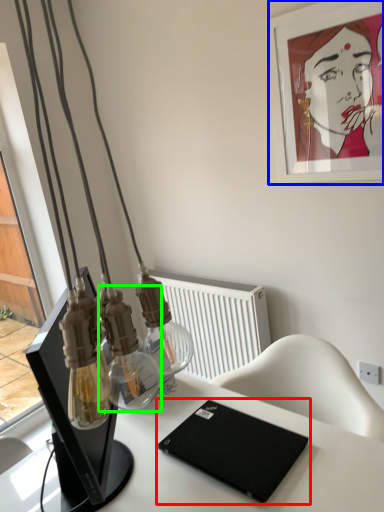
Question: Estimate the real-world distances between objects in this image. Which object is farther from laptop (highlighted by a red box), picture frame (highlighted by a blue box) or bottle (highlighted by a green box)?

Choices:
 (A) picture frame
 (B) bottle

Answer: (A)